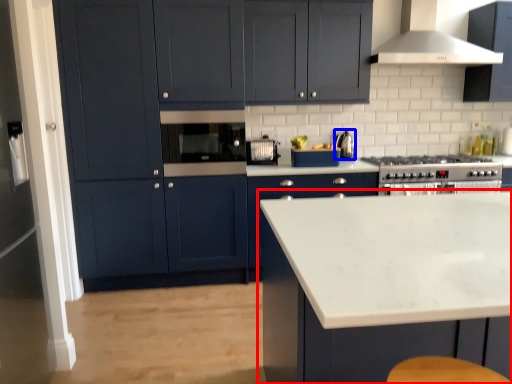
Question: Which point is closer to the camera, cabinetry (highlighted by a red box) or kitchen appliance (highlighted by a blue box)?

Choices:
 (A) cabinetry
 (B) kitchen appliance

Answer: (A)